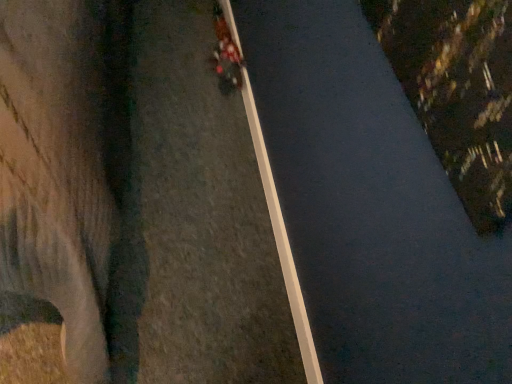
Locate an element on the screen. The image size is (512, 384). metallic red motorcycle at center is located at coordinates (226, 50).

Describe the element at coordinates (226, 50) in the screenshot. Image resolution: width=512 pixels, height=384 pixels. I see `metallic red motorcycle at center` at that location.

Locate an element on the screen. Image resolution: width=512 pixels, height=384 pixels. white smooth curb at center is located at coordinates (282, 240).

What do you see at coordinates (282, 240) in the screenshot? This screenshot has height=384, width=512. I see `white smooth curb at center` at bounding box center [282, 240].

Where is `metallic red motorcycle at center`? The image size is (512, 384). metallic red motorcycle at center is located at coordinates (226, 50).

Between metallic red motorcycle at center and white smooth curb at center, which one appears on the left side from the viewer's perspective?

Positioned to the left is metallic red motorcycle at center.

Considering the positions of objects metallic red motorcycle at center and white smooth curb at center in the image provided, who is in front, metallic red motorcycle at center or white smooth curb at center?

white smooth curb at center is closer to the camera.

Does point (227, 46) come farther from viewer compared to point (277, 243)?

Yes.

From the image's perspective, is metallic red motorcycle at center under white smooth curb at center?

Actually, metallic red motorcycle at center appears above white smooth curb at center in the image.

From a real-world perspective, who is located lower, metallic red motorcycle at center or white smooth curb at center?

white smooth curb at center, from a real-world perspective.

Does metallic red motorcycle at center have a lesser width compared to white smooth curb at center?

In fact, metallic red motorcycle at center might be wider than white smooth curb at center.

Can you confirm if metallic red motorcycle at center is shorter than white smooth curb at center?

In fact, metallic red motorcycle at center may be taller than white smooth curb at center.

Does metallic red motorcycle at center have a smaller size compared to white smooth curb at center?

Incorrect, metallic red motorcycle at center is not smaller in size than white smooth curb at center.

Could white smooth curb at center be considered to be inside metallic red motorcycle at center?

No, white smooth curb at center is not inside metallic red motorcycle at center.

Does metallic red motorcycle at center touch white smooth curb at center?

No, metallic red motorcycle at center is not next to white smooth curb at center.

Is metallic red motorcycle at center turned away from white smooth curb at center?

No.

How different are the orientations of metallic red motorcycle at center and white smooth curb at center in degrees?

2.74 degrees separate the facing orientations of metallic red motorcycle at center and white smooth curb at center.

Where is `curb on the right of metallic red motorcycle at center`? Image resolution: width=512 pixels, height=384 pixels. curb on the right of metallic red motorcycle at center is located at coordinates (282, 240).

Between white smooth curb at center and metallic red motorcycle at center, which one appears on the left side from the viewer's perspective?

Positioned to the left is metallic red motorcycle at center.

Does white smooth curb at center come in front of metallic red motorcycle at center?

Yes.

Considering the positions of points (272, 218) and (231, 61), is point (272, 218) farther from camera compared to point (231, 61)?

No, (272, 218) is in front of (231, 61).

From the image's perspective, which one is positioned higher, white smooth curb at center or metallic red motorcycle at center?

metallic red motorcycle at center.

From a real-world perspective, which object stands above the other?

metallic red motorcycle at center is physically above.

Consider the image. Considering the relative sizes of white smooth curb at center and metallic red motorcycle at center in the image provided, is white smooth curb at center thinner than metallic red motorcycle at center?

Indeed, white smooth curb at center has a lesser width compared to metallic red motorcycle at center.

Who is shorter, white smooth curb at center or metallic red motorcycle at center?

white smooth curb at center.

Which of these two, white smooth curb at center or metallic red motorcycle at center, is smaller?

Smaller between the two is white smooth curb at center.

Is metallic red motorcycle at center completely or partially inside white smooth curb at center?

No, metallic red motorcycle at center is located outside of white smooth curb at center.

Is white smooth curb at center touching metallic red motorcycle at center?

white smooth curb at center and metallic red motorcycle at center are clearly separated.

Is white smooth curb at center aimed at metallic red motorcycle at center?

No, white smooth curb at center is not aimed at metallic red motorcycle at center.

Looking at this image, how distant is white smooth curb at center from metallic red motorcycle at center?

white smooth curb at center and metallic red motorcycle at center are 10.62 inches apart from each other.

At what (x,y) coordinates should I click in order to perform the action: click on curb that appears below the metallic red motorcycle at center (from the image's perspective). Please return your answer as a coordinate pair (x, y). The height and width of the screenshot is (384, 512). Looking at the image, I should click on (282, 240).

You are a GUI agent. You are given a task and a screenshot of the screen. Output one action in this format:
    pyautogui.click(x=<x>, y=<y>)
    Task: Click on the curb below the metallic red motorcycle at center (from a real-world perspective)
    This screenshot has height=384, width=512.
    Given the screenshot: What is the action you would take?
    pyautogui.click(x=282, y=240)

What are the coordinates of `vehicle behind the white smooth curb at center` in the screenshot? It's located at (226, 50).